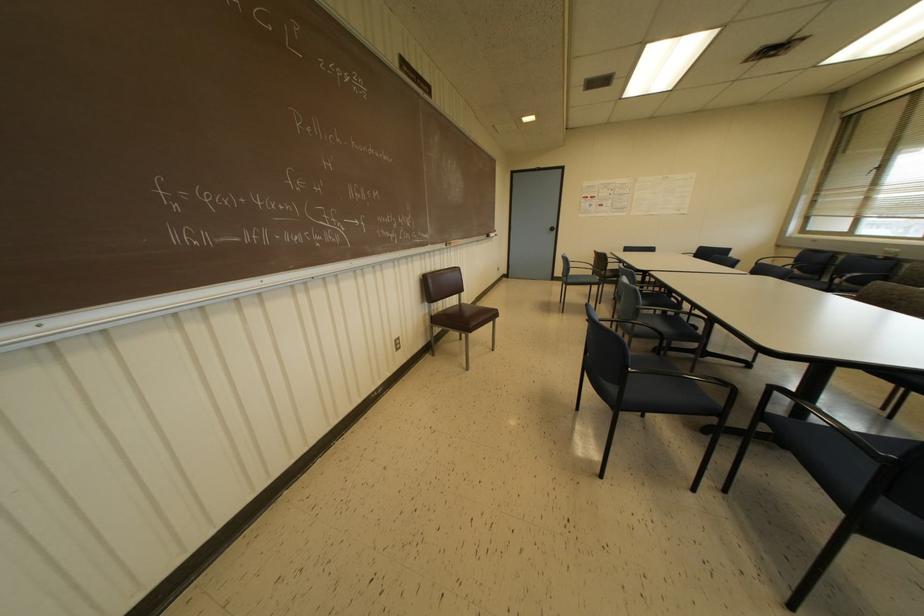
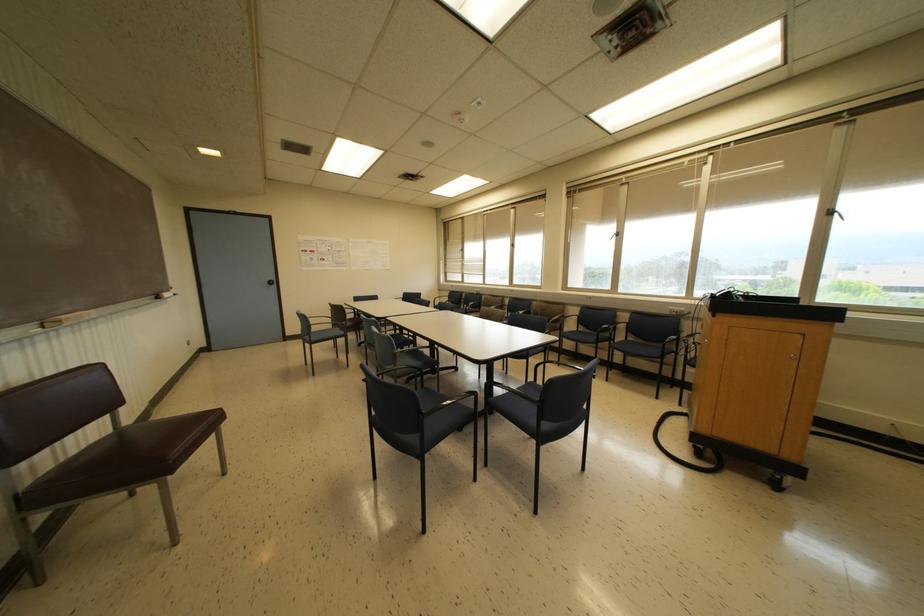
Find the pixel in the second image that matches (x=487, y=236) in the first image.

(157, 297)